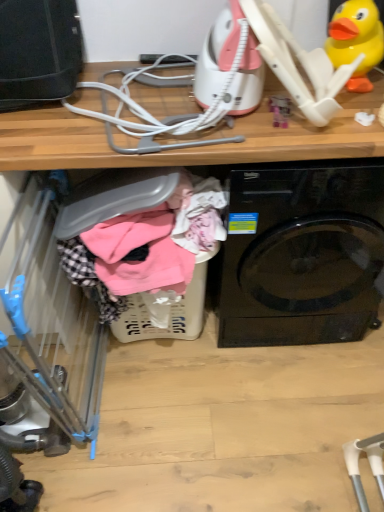
Question: From the image's perspective, is yellow rubber duck at upper right above blue plastic baby carriage at left?

Choices:
 (A) yes
 (B) no

Answer: (A)

Question: Can you confirm if yellow rubber duck at upper right is wider than blue plastic baby carriage at left?

Choices:
 (A) yes
 (B) no

Answer: (B)

Question: Considering the relative sizes of yellow rubber duck at upper right and blue plastic baby carriage at left in the image provided, is yellow rubber duck at upper right thinner than blue plastic baby carriage at left?

Choices:
 (A) no
 (B) yes

Answer: (B)

Question: Is yellow rubber duck at upper right bigger than blue plastic baby carriage at left?

Choices:
 (A) yes
 (B) no

Answer: (B)

Question: From a real-world perspective, is yellow rubber duck at upper right positioned under blue plastic baby carriage at left based on gravity?

Choices:
 (A) no
 (B) yes

Answer: (A)

Question: From a real-world perspective, is yellow rubber duck at upper right positioned above or below black glossy washing machine at center?

Choices:
 (A) below
 (B) above

Answer: (B)

Question: In terms of size, does yellow rubber duck at upper right appear bigger or smaller than black glossy washing machine at center?

Choices:
 (A) small
 (B) big

Answer: (A)

Question: Is yellow rubber duck at upper right inside the boundaries of black glossy washing machine at center, or outside?

Choices:
 (A) inside
 (B) outside

Answer: (B)

Question: Relative to black glossy washing machine at center, is yellow rubber duck at upper right in front or behind?

Choices:
 (A) behind
 (B) front

Answer: (A)

Question: Considering the positions of point (241, 222) and point (177, 304), is point (241, 222) closer or farther from the camera than point (177, 304)?

Choices:
 (A) farther
 (B) closer

Answer: (B)

Question: Looking at the image, does black glossy washing machine at center seem bigger or smaller compared to plastic laundry basket at lower center?

Choices:
 (A) small
 (B) big

Answer: (B)

Question: Is black glossy washing machine at center wider or thinner than plastic laundry basket at lower center?

Choices:
 (A) wide
 (B) thin

Answer: (A)

Question: Is black glossy washing machine at center in front of or behind plastic laundry basket at lower center in the image?

Choices:
 (A) front
 (B) behind

Answer: (A)

Question: Considering their positions, is plastic laundry basket at lower center located in front of or behind black glossy washing machine at center?

Choices:
 (A) front
 (B) behind

Answer: (B)

Question: Is plastic laundry basket at lower center to the left or to the right of black glossy washing machine at center in the image?

Choices:
 (A) right
 (B) left

Answer: (B)